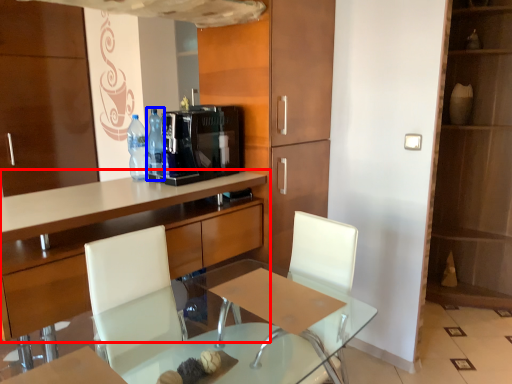
Question: Which object is further to the camera taking this photo, cabinetry (highlighted by a red box) or bottle (highlighted by a blue box)?

Choices:
 (A) cabinetry
 (B) bottle

Answer: (B)